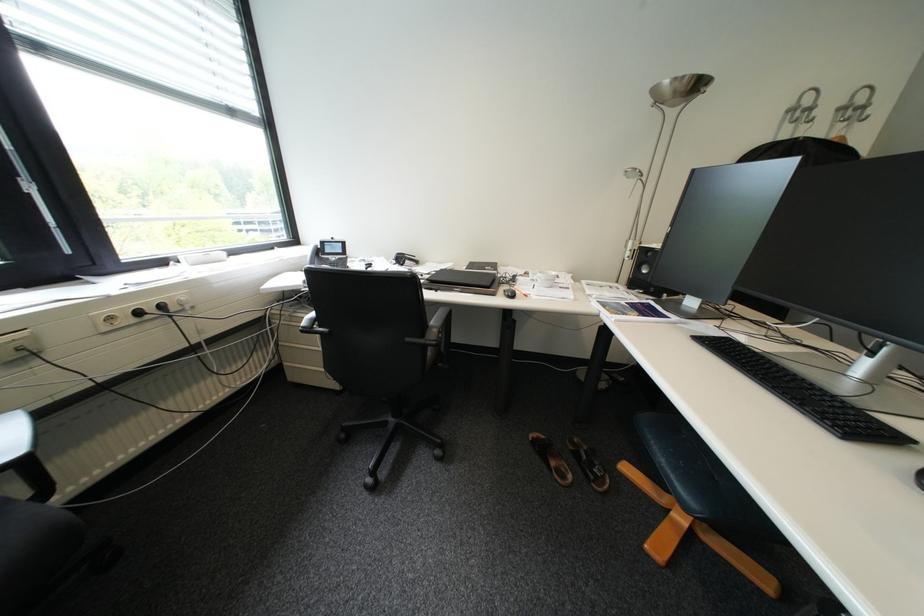
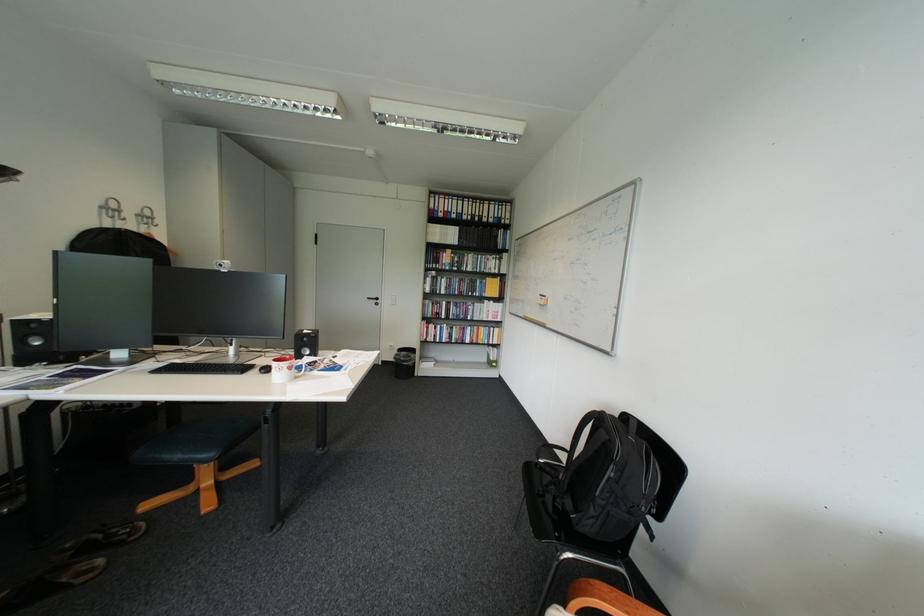
In the second image, find the point that corresponds to pixel 657 272 in the first image.

(51, 344)